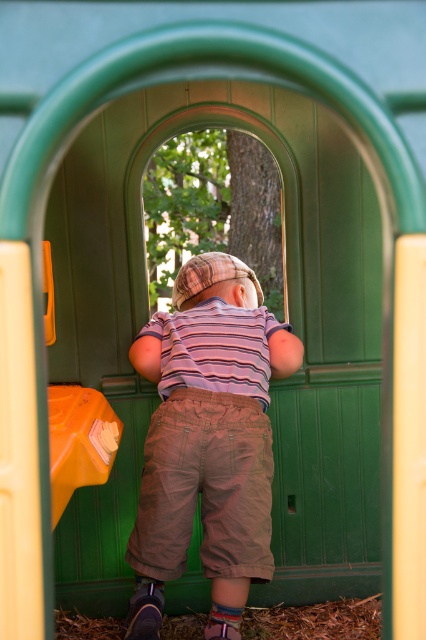
Consider the image. You are a parent trying to ensure your child can reach the green matte door at center to open it. Based on their position relative to the striped cotton shirt at center, can you determine if the door is within their reach?

The green matte door at center is further to the viewer than the striped cotton shirt at center, meaning the door is closer to the child. Since the child is touching the door, it is definitely within their reach.

You are a parent trying to decide if your child can easily reach the handle on the green matte door at center while sliding down the orange plastic slide at left. Based on their heights, can your child reach the door handle?

The green matte door at center has a greater height compared to orange plastic slide at left. Since the door is taller, the handle might be positioned higher, making it harder for the child to reach while sliding down the slide.